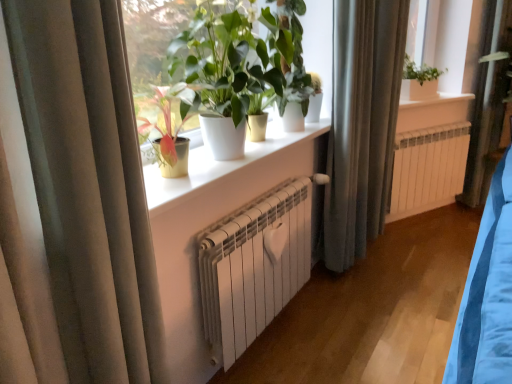
Question: Is white matte radiator at center positioned with its back to green glossy plant at center, which is counted as the second houseplant, starting from the front?

Choices:
 (A) yes
 (B) no

Answer: (B)

Question: Is white matte radiator at center closer to camera compared to green glossy plant at center, which is the 1th houseplant from back to front?

Choices:
 (A) yes
 (B) no

Answer: (A)

Question: Does white matte radiator at center appear on the right side of green glossy plant at center, which is counted as the second houseplant, starting from the front?

Choices:
 (A) yes
 (B) no

Answer: (B)

Question: Does white matte radiator at center have a smaller size compared to green glossy plant at center, which is the 1th houseplant from back to front?

Choices:
 (A) yes
 (B) no

Answer: (B)

Question: From a real-world perspective, does white matte radiator at center stand above green glossy plant at center, which is counted as the second houseplant, starting from the front?

Choices:
 (A) no
 (B) yes

Answer: (A)

Question: Is white matte radiator at center not inside green glossy plant at center, which is counted as the second houseplant, starting from the front?

Choices:
 (A) yes
 (B) no

Answer: (A)

Question: Is white glossy pot at center, the 1th houseplant positioned from the front, oriented away from white matte radiator at center?

Choices:
 (A) no
 (B) yes

Answer: (A)

Question: From a real-world perspective, does white glossy pot at center, the second houseplant viewed from the back, stand above white matte radiator at center?

Choices:
 (A) yes
 (B) no

Answer: (A)

Question: Is white glossy pot at center, the 1th houseplant positioned from the front, smaller than white matte radiator at center?

Choices:
 (A) no
 (B) yes

Answer: (A)

Question: Is white glossy pot at center, the 1th houseplant positioned from the front, to the left of white matte radiator at center from the viewer's perspective?

Choices:
 (A) yes
 (B) no

Answer: (A)

Question: Is white glossy pot at center, the second houseplant viewed from the back, positioned far away from white matte radiator at center?

Choices:
 (A) no
 (B) yes

Answer: (A)

Question: From the image's perspective, is white glossy pot at center, the second houseplant viewed from the back, below white matte radiator at center?

Choices:
 (A) yes
 (B) no

Answer: (B)

Question: Considering the relative sizes of silky gray curtain at center, which is the second curtain in front-to-back order, and white ceramic window sill at upper center, which is the second window sill from bottom to top, in the image provided, is silky gray curtain at center, which is the second curtain in front-to-back order, bigger than white ceramic window sill at upper center, which is the second window sill from bottom to top,?

Choices:
 (A) yes
 (B) no

Answer: (A)